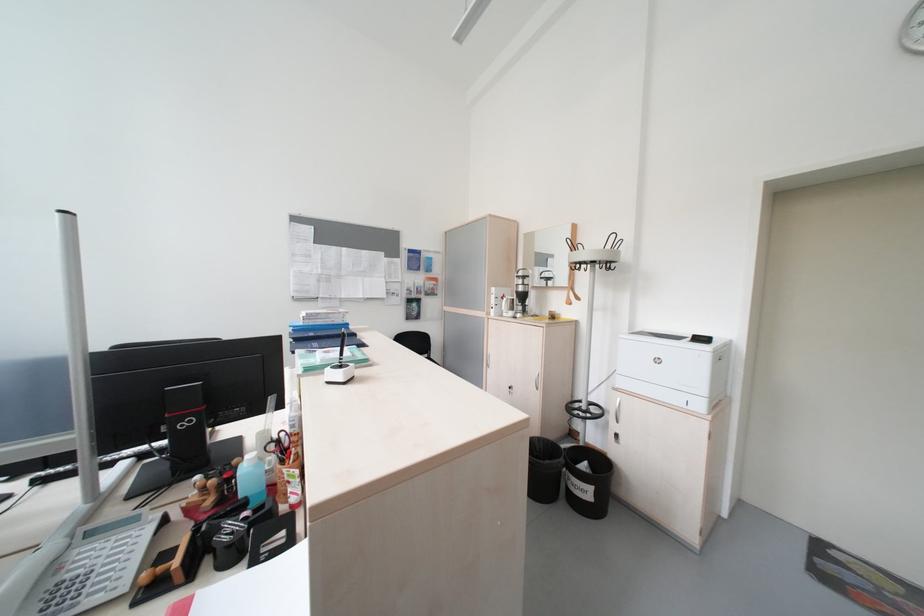
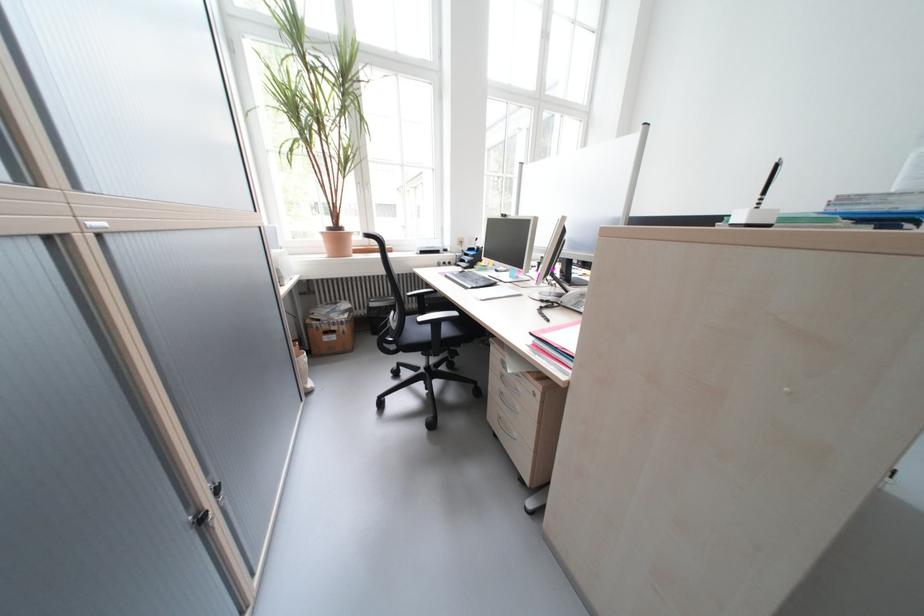
How did the camera likely rotate?

The rotation direction of the camera is left-down.